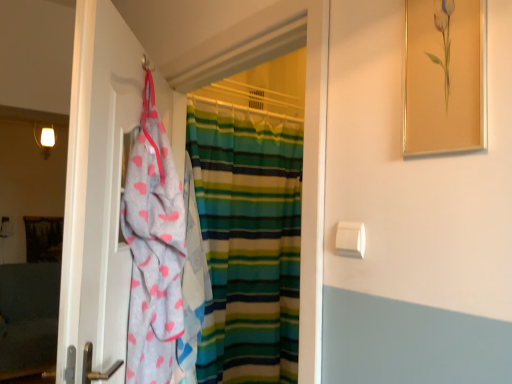
Question: Would you say striped fabric curtain at center is to the left or to the right of gray fabric towel at left in the picture?

Choices:
 (A) left
 (B) right

Answer: (B)

Question: Does point (245, 296) appear closer or farther from the camera than point (65, 251)?

Choices:
 (A) farther
 (B) closer

Answer: (A)

Question: Which of these objects is positioned farthest from the striped fabric curtain at center?

Choices:
 (A) gold-framed painting at upper right
 (B) white plastic towel bar at center right
 (C) gray fabric towel at left

Answer: (A)

Question: Based on their relative distances, which object is nearer to the white plastic towel bar at center right?

Choices:
 (A) gray fabric towel at left
 (B) striped fabric curtain at center
 (C) gold-framed painting at upper right

Answer: (C)